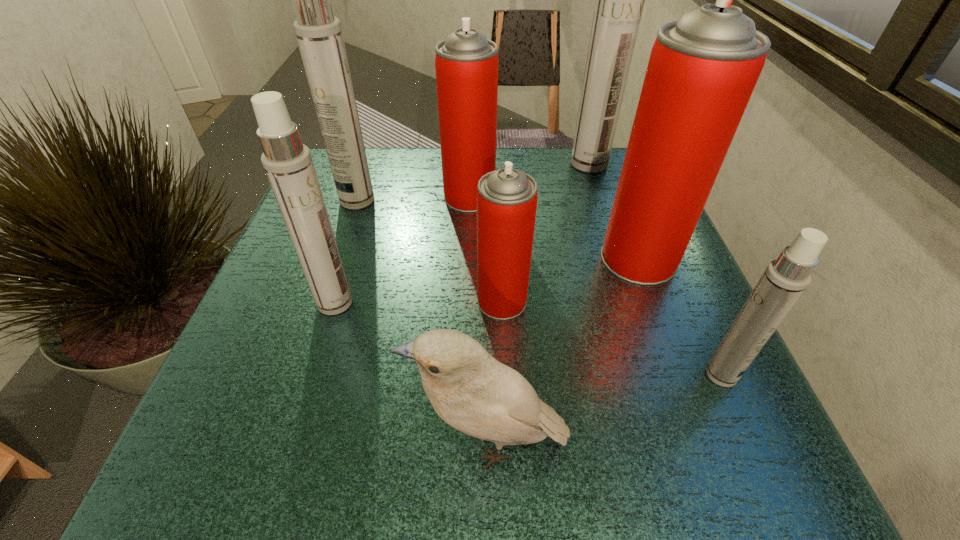
This screenshot has height=540, width=960. I want to click on free space located at the beak of the white bird, so click(328, 443).

The width and height of the screenshot is (960, 540). I want to click on object that is positioned at the near edge, so click(x=470, y=390).

Find the location of a particular element. The image size is (960, 540). object that is at the far left corner is located at coordinates (319, 35).

Where is `object at the far right corner`? This screenshot has height=540, width=960. object at the far right corner is located at coordinates (620, 0).

In the image, there is a desktop. What are the coordinates of `free region at the far edge` in the screenshot? It's located at (401, 174).

Locate an element on the screen. Image resolution: width=960 pixels, height=540 pixels. free region at the left edge of the desktop is located at coordinates (284, 361).

Identify the location of free space at the right edge of the desktop. (592, 224).

Where is `free space at the far left corner`? The image size is (960, 540). free space at the far left corner is located at coordinates (379, 152).

The image size is (960, 540). Find the location of `vacant space at the far right corner of the desktop`. vacant space at the far right corner of the desktop is located at coordinates (597, 188).

Locate an element on the screen. free region at the near right corner is located at coordinates (745, 436).